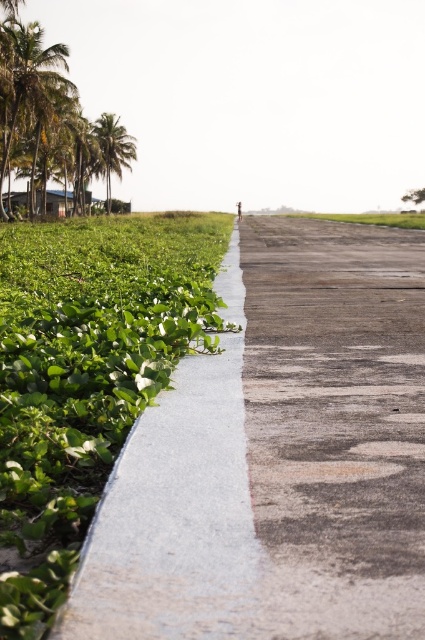
Question: Which point is farther to the camera?

Choices:
 (A) (110, 200)
 (B) (261, 436)
 (C) (410, 470)

Answer: (A)

Question: Does white smooth pavement at center come in front of green leafy palm trees at upper left?

Choices:
 (A) yes
 (B) no

Answer: (A)

Question: Which of the following is the farthest from the observer?

Choices:
 (A) (125, 132)
 (B) (14, 129)
 (C) (359, 408)

Answer: (A)

Question: Among these points, which one is nearest to the camera?

Choices:
 (A) (280, 291)
 (B) (119, 499)
 (C) (70, 90)
 (D) (99, 150)

Answer: (B)

Question: Does white smooth pavement at center appear on the right side of green leafy palm tree at upper left?

Choices:
 (A) no
 (B) yes

Answer: (B)

Question: Does white smooth pavement at center come in front of green leafy palm trees at upper left?

Choices:
 (A) yes
 (B) no

Answer: (A)